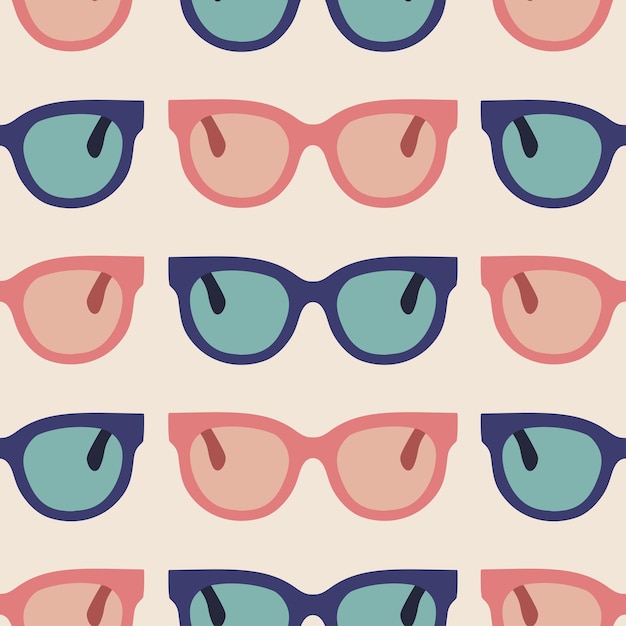
Find the location of `full glasses`. full glasses is located at coordinates (317, 0), (312, 131), (313, 295), (312, 448), (315, 602).